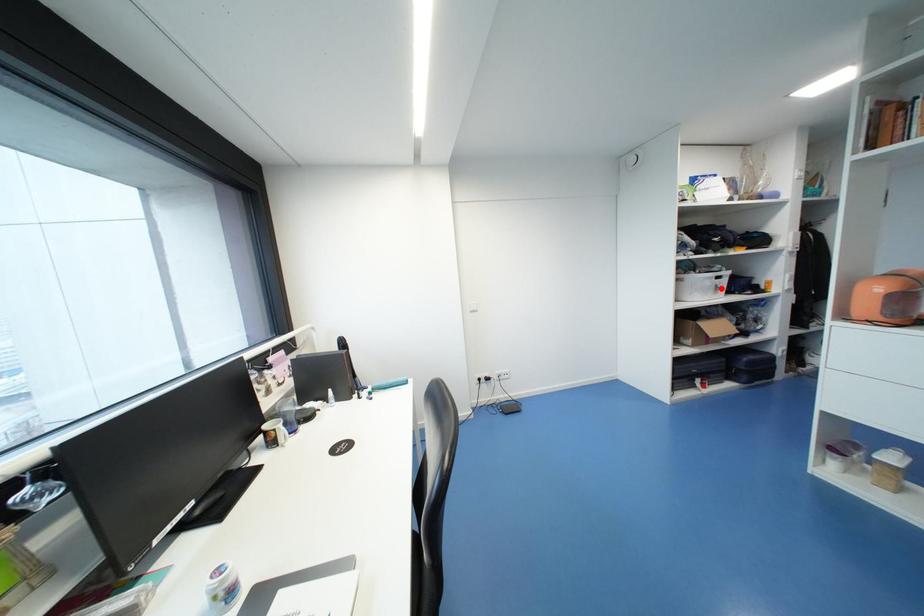
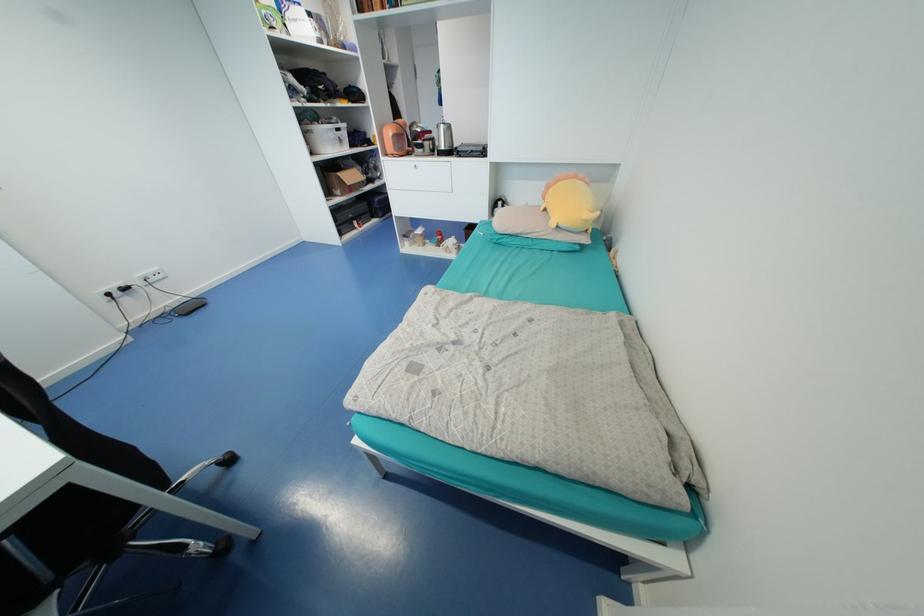
Question: I am providing you with two images of the same scene from different viewpoints. Given a red point in image1, look at the same physical point in image2. Is it:

Choices:
 (A) Closer to the viewpoint
 (B) Farther from the viewpoint

Answer: (A)